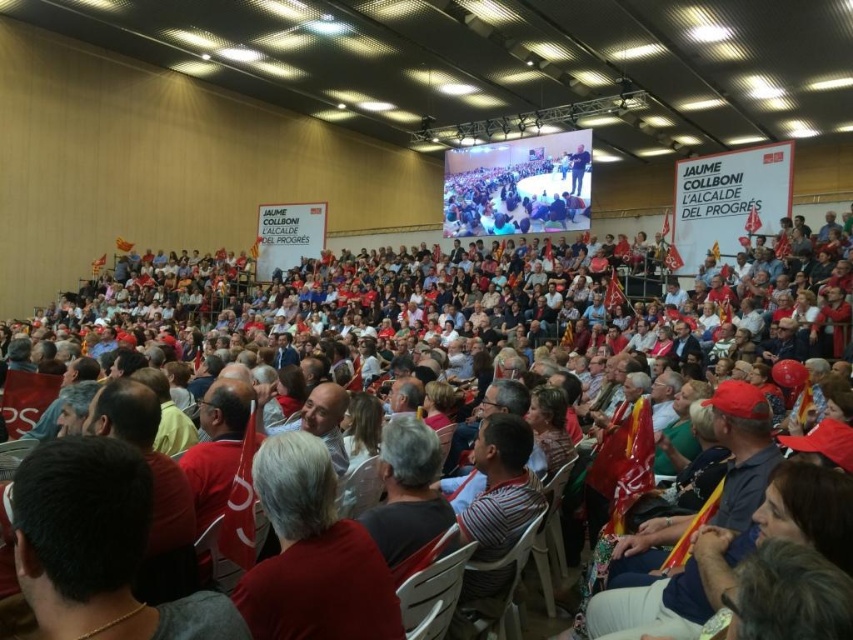
The image size is (853, 640). Identify the location of red shirt at lower left. (97, 547).

Is the position of red shirt at lower left less distant than that of red fabric hat at center?

Yes, it is in front of red fabric hat at center.

You are a GUI agent. You are given a task and a screenshot of the screen. Output one action in this format:
    pyautogui.click(x=<x>, y=<y>)
    Task: Click on the red shirt at lower left
    The image size is (853, 640).
    Given the screenshot: What is the action you would take?
    pyautogui.click(x=97, y=547)

Does red fabric at center have a lesser height compared to red fabric hat at center?

In fact, red fabric at center may be taller than red fabric hat at center.

Can you confirm if red fabric at center is bigger than red fabric hat at center?

Yes, red fabric at center is bigger than red fabric hat at center.

Does point (306, 502) lie in front of point (422, 532)?

Yes, point (306, 502) is closer to viewer.

At what (x,y) coordinates should I click in order to perform the action: click on red fabric at center. Please return your answer as a coordinate pair (x, y). Looking at the image, I should click on (312, 554).

This screenshot has height=640, width=853. What do you see at coordinates (97, 547) in the screenshot? I see `red shirt at lower left` at bounding box center [97, 547].

I want to click on red shirt at lower left, so click(x=97, y=547).

Where is `red shirt at lower left`? Image resolution: width=853 pixels, height=640 pixels. red shirt at lower left is located at coordinates pos(97,547).